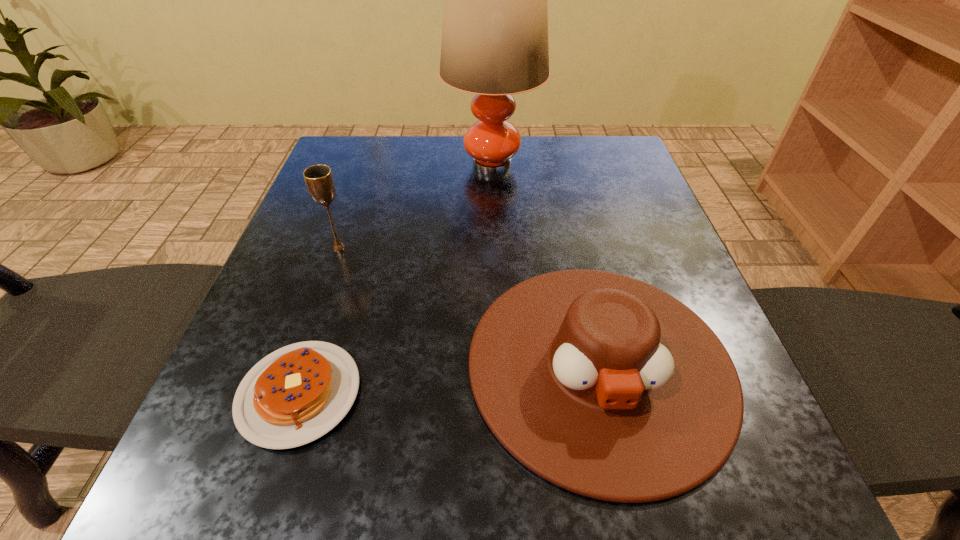
This screenshot has width=960, height=540. I want to click on cowboy hat located at the near edge, so click(x=604, y=385).

Locate an element on the screen. The width and height of the screenshot is (960, 540). pancake that is at the near edge is located at coordinates (296, 394).

Locate an element on the screen. chalice located in the left edge section of the desktop is located at coordinates (319, 180).

What are the coordinates of `pancake positioned at the left edge` in the screenshot? It's located at (296, 394).

Image resolution: width=960 pixels, height=540 pixels. Find the location of `object present at the right edge`. object present at the right edge is located at coordinates (604, 385).

The image size is (960, 540). Identify the location of object at the near left corner. (296, 394).

Where is `object present at the near right corner`? The image size is (960, 540). object present at the near right corner is located at coordinates (604, 385).

Where is `free space at the far edge of the desktop`? This screenshot has width=960, height=540. free space at the far edge of the desktop is located at coordinates (522, 163).

In the image, there is a desktop. Where is `vacant area at the left edge`? vacant area at the left edge is located at coordinates (259, 321).

This screenshot has width=960, height=540. In order to click on vacant space at the right edge of the desktop in this screenshot , I will do tap(599, 208).